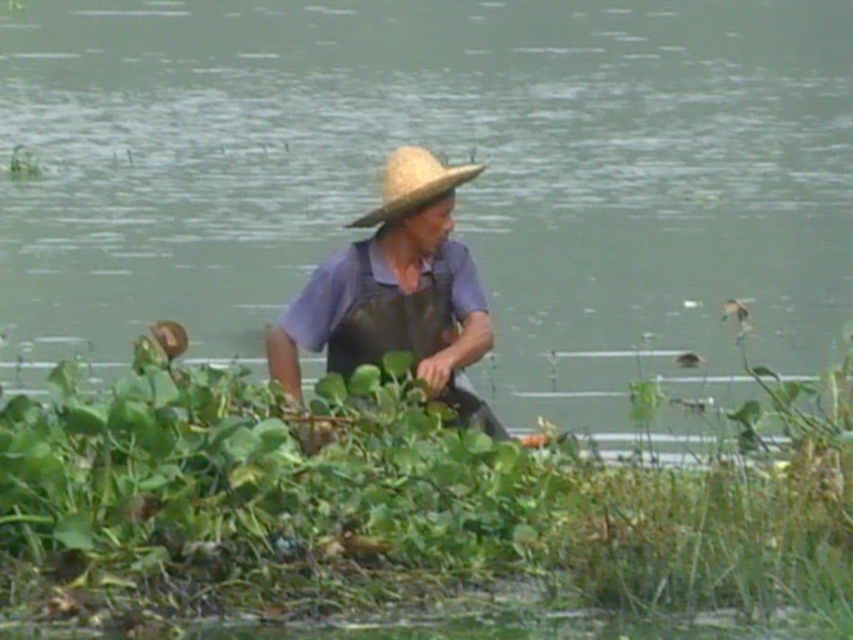
You are standing at the edge of the pond and see two points in the scene, point (814,67) and point (451,186). Which point is closer to you?

Point (814,67) is further to the viewer than point (451,186), so point (451,186) is closer to you.